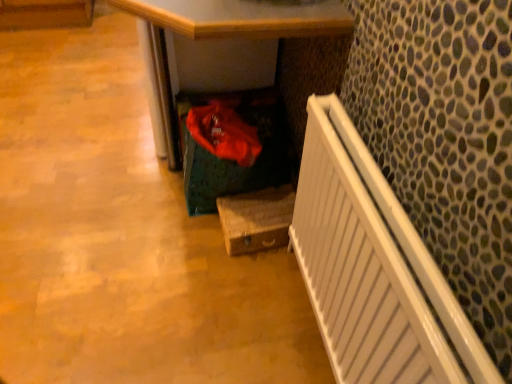
Where is `vacant area that lies in front of wooden box at lower center`? This screenshot has height=384, width=512. vacant area that lies in front of wooden box at lower center is located at coordinates (250, 281).